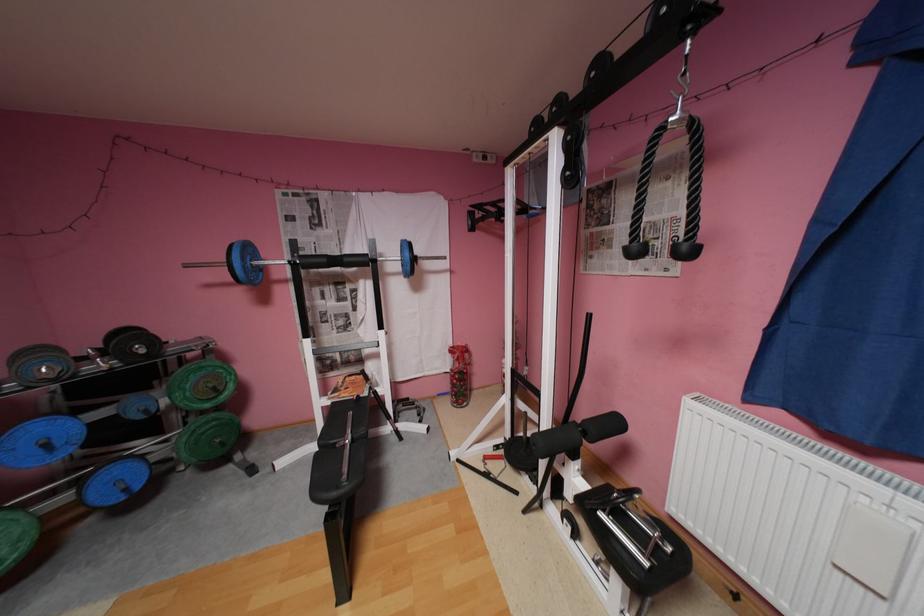
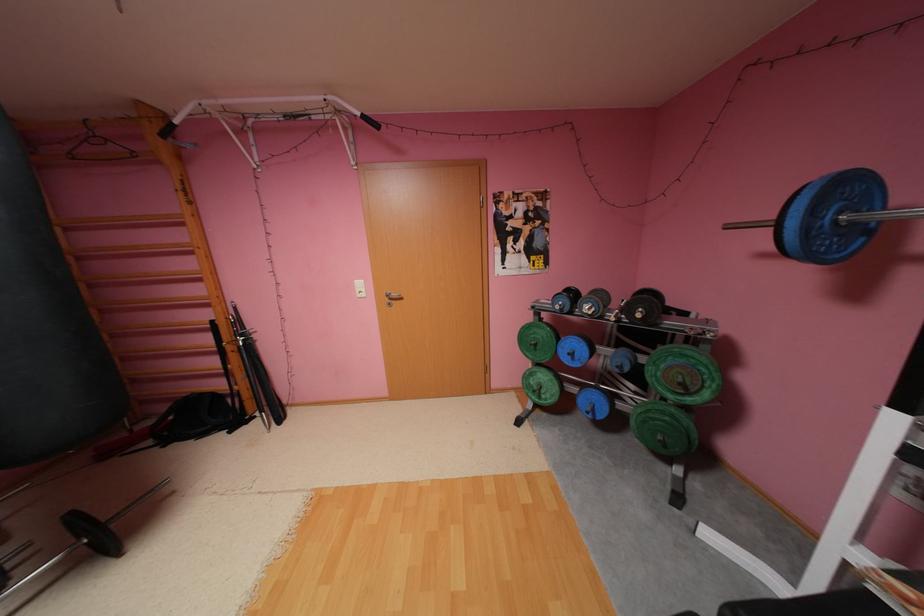
Question: I am providing you with two images of the same scene from different viewpoints. After the viewpoint changes to image2, which objects are now occluded?

Choices:
 (A) white light switch
 (B) blue weight plate
 (C) green weight plate
 (D) none of these

Answer: (D)